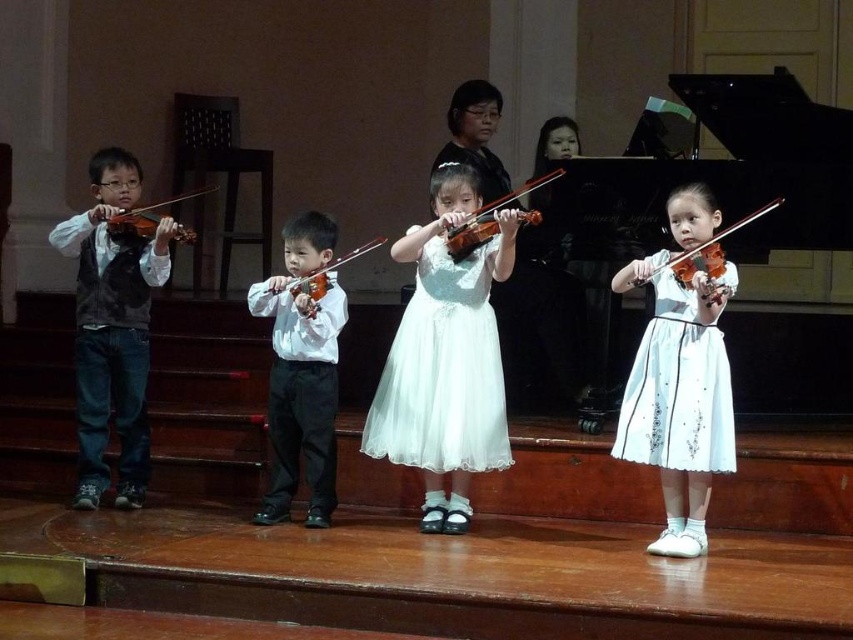
Question: Among these points, which one is nearest to the camera?

Choices:
 (A) (698, 243)
 (B) (318, 308)

Answer: (A)

Question: Observing the image, what is the correct spatial positioning of white lace dress at center in reference to matte orange violin at center?

Choices:
 (A) above
 (B) below

Answer: (B)

Question: Which point is closer to the camera?

Choices:
 (A) (466, 225)
 (B) (308, 212)

Answer: (A)

Question: Which point is farther to the camera?

Choices:
 (A) (334, 365)
 (B) (460, 227)
 (C) (479, 320)
 (D) (300, 292)

Answer: (A)

Question: Does white tulle dress at center appear on the left side of matte brown violin at center?

Choices:
 (A) no
 (B) yes

Answer: (A)

Question: Can you confirm if white smooth shirt at center is positioned below white glossy violin at center?

Choices:
 (A) no
 (B) yes

Answer: (B)